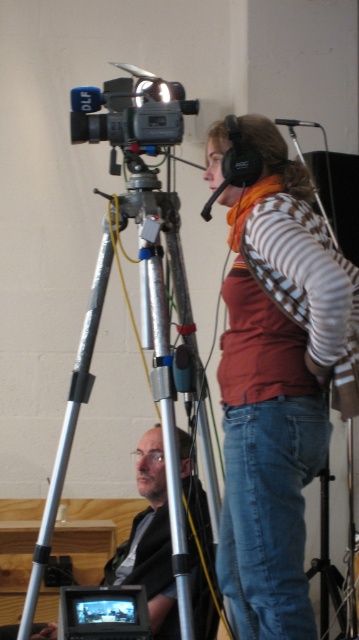
Question: Which object is farther from the camera taking this photo?

Choices:
 (A) striped cotton shirt at center
 (B) matte black camera at upper center
 (C) black plastic camera at center

Answer: (B)

Question: Can you confirm if striped cotton shirt at center is positioned to the right of matte black camera at upper center?

Choices:
 (A) no
 (B) yes

Answer: (B)

Question: Is striped cotton shirt at center bigger than silver metallic tripod at center?

Choices:
 (A) yes
 (B) no

Answer: (B)

Question: Is silver metallic tripod at center above black plastic camera at center?

Choices:
 (A) yes
 (B) no

Answer: (A)

Question: Based on their relative distances, which object is nearer to the matte black camera at upper center?

Choices:
 (A) black plastic camera at center
 (B) striped cotton shirt at center

Answer: (B)

Question: Which object is the farthest from the black plastic camera at center?

Choices:
 (A) silver metallic tripod at center
 (B) matte black camera at upper center
 (C) striped cotton shirt at center

Answer: (B)